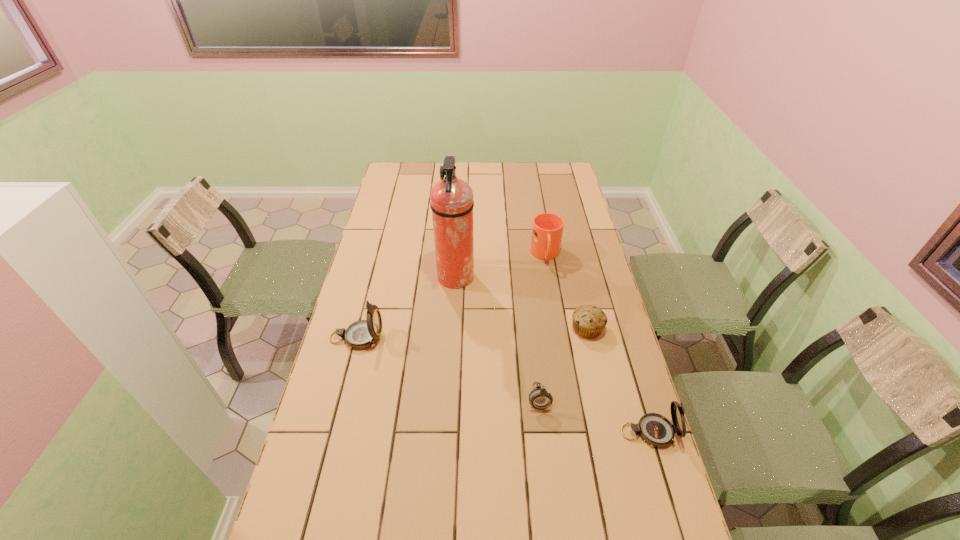
I want to click on vacant space that's between the leftmost compass and the shortest compass, so click(x=447, y=367).

Locate an element on the screen. free space between the mug and the fifth farthest object is located at coordinates (542, 326).

Where is `vacant space that's between the muffin and the farthest compass`? vacant space that's between the muffin and the farthest compass is located at coordinates (472, 333).

This screenshot has width=960, height=540. Find the location of `vacant area that lies between the tallest object and the second compass from right to left`. vacant area that lies between the tallest object and the second compass from right to left is located at coordinates (497, 338).

Locate an element on the screen. This screenshot has width=960, height=540. object that is the fourth closest one to the farthest compass is located at coordinates (589, 321).

Identify which object is the second nearest to the leftmost object. Please provide its 2D coordinates. Your answer should be formatted as a tuple, i.e. [(x, y)], where the tuple contains the x and y coordinates of a point satisfying the conditions above.

[(539, 398)]

Choose which compass is the nearest neighbor to the mug. Please provide its 2D coordinates. Your answer should be formatted as a tuple, i.e. [(x, y)], where the tuple contains the x and y coordinates of a point satisfying the conditions above.

[(539, 398)]

Identify the location of compass that is the third closest to the muffin. (362, 334).

Where is `vacant area that satisfies the following two spatial constraints: 1. at the nozzle of the muffin; 2. on the left side of the fire extinguisher`? The width and height of the screenshot is (960, 540). vacant area that satisfies the following two spatial constraints: 1. at the nozzle of the muffin; 2. on the left side of the fire extinguisher is located at coordinates (453, 328).

You are a GUI agent. You are given a task and a screenshot of the screen. Output one action in this format:
    pyautogui.click(x=<x>, y=<y>)
    Task: Click on the free space that satisfies the following two spatial constraints: 1. on the handle side of the muffin; 2. on the right side of the mug
    This screenshot has width=960, height=540.
    Given the screenshot: What is the action you would take?
    pyautogui.click(x=558, y=328)